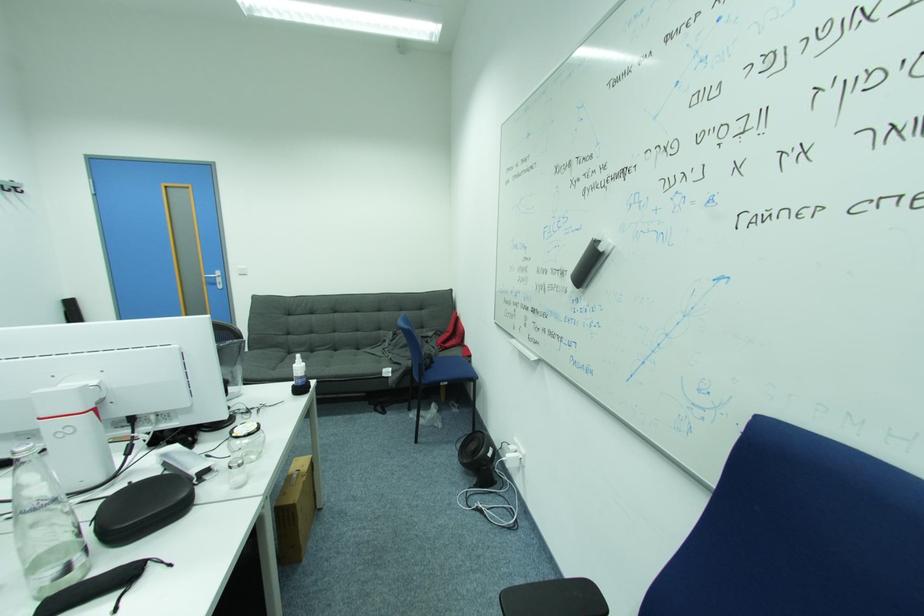
What do you see at coordinates (245, 437) in the screenshot? The width and height of the screenshot is (924, 616). I see `the glass jar lid` at bounding box center [245, 437].